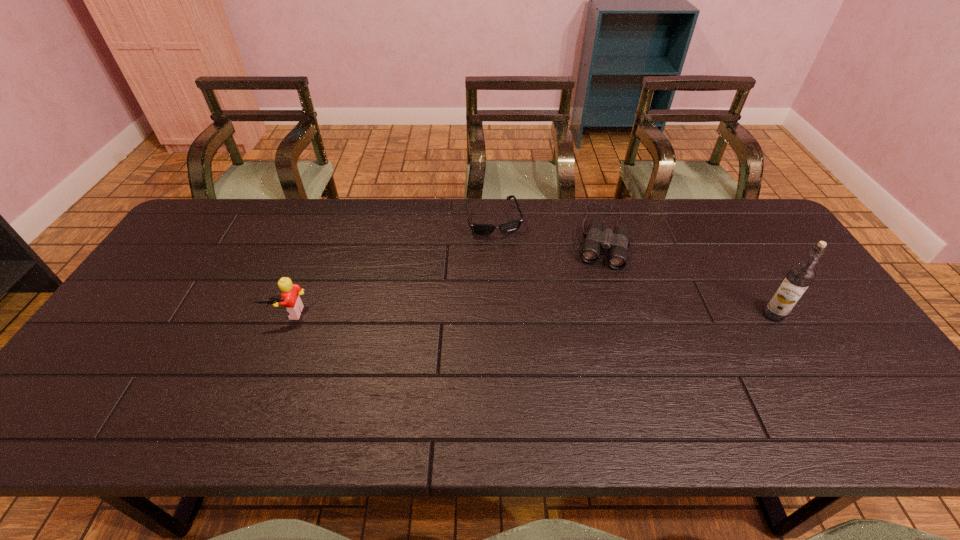
Find the location of a particular element. This screenshot has height=540, width=960. blank region between the second object from left to right and the tallest object is located at coordinates (634, 268).

Find the location of a particular element. This screenshot has width=960, height=540. unoccupied position between the second object from left to right and the binoculars is located at coordinates (547, 228).

I want to click on free space between the third object from left to right and the leftmost object, so click(x=444, y=274).

The width and height of the screenshot is (960, 540). I want to click on free space between the binoculars and the Lego, so click(x=444, y=274).

Point out which object is positioned as the third nearest to the sunglasses. Please provide its 2D coordinates. Your answer should be formatted as a tuple, i.e. [(x, y)], where the tuple contains the x and y coordinates of a point satisfying the conditions above.

[(798, 278)]

In order to click on object that is the third closest one to the sunglasses in this screenshot , I will do `click(798, 278)`.

Identify the location of free location that satisfies the following two spatial constraints: 1. on the front side of the tallest object; 2. on the label of the second object from right to left. The image size is (960, 540). (624, 315).

Image resolution: width=960 pixels, height=540 pixels. Identify the location of vacant space that satisfies the following two spatial constraints: 1. on the front side of the second object from left to right; 2. on the label of the vodka. (497, 315).

The image size is (960, 540). What are the coordinates of `free space that satisfies the following two spatial constraints: 1. in front of the rightmost object with the accessory visible; 2. on the label of the third shortest object` in the screenshot? It's located at (288, 315).

This screenshot has width=960, height=540. What are the coordinates of `vacant point that satisfies the following two spatial constraints: 1. on the front side of the tallest object; 2. on the label of the sunglasses` in the screenshot? It's located at (497, 315).